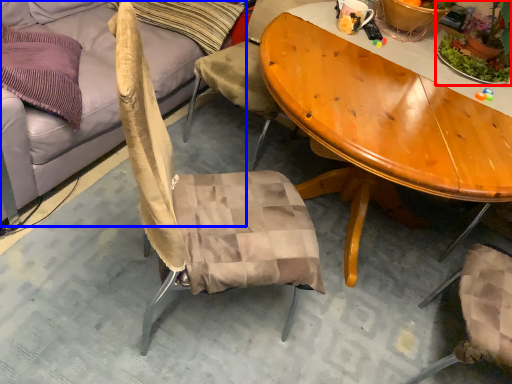
Question: Which object is further to the camera taking this photo, houseplant (highlighted by a red box) or studio couch (highlighted by a blue box)?

Choices:
 (A) houseplant
 (B) studio couch

Answer: (A)